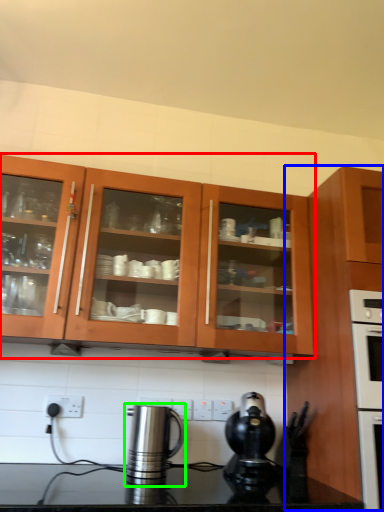
Question: Estimate the real-world distances between objects in this image. Which object is farther from cabinetry (highlighted by a red box), cabinetry (highlighted by a blue box) or kitchen appliance (highlighted by a green box)?

Choices:
 (A) cabinetry
 (B) kitchen appliance

Answer: (B)